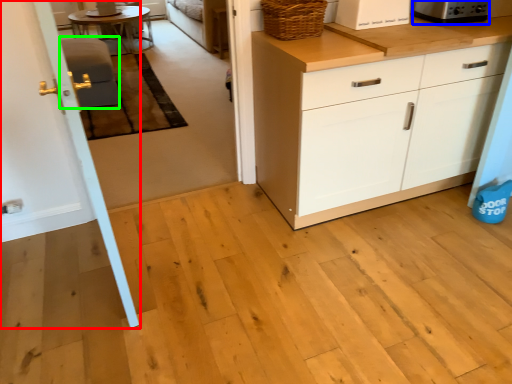
Question: Considering the real-world distances, which object is closest to door (highlighted by a red box)? appliance (highlighted by a blue box) or armchair (highlighted by a green box).

Choices:
 (A) appliance
 (B) armchair

Answer: (B)